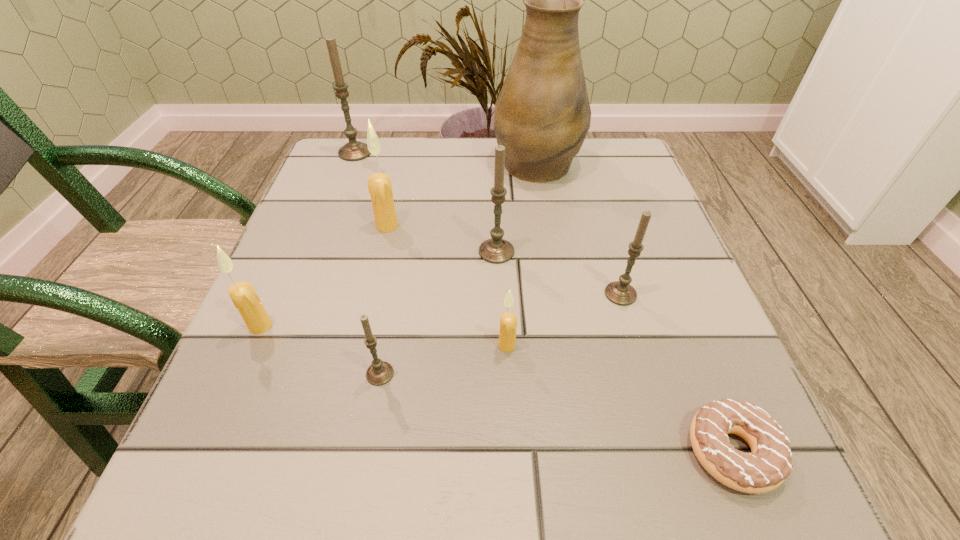
Locate an element on the screen. doughnut present at the right edge is located at coordinates (768, 465).

This screenshot has width=960, height=540. I want to click on object present at the far left corner, so point(354,150).

What are the coordinates of `object positioned at the far right corner` in the screenshot? It's located at (542, 115).

What are the coordinates of `object at the near right corner` in the screenshot? It's located at (768, 465).

Image resolution: width=960 pixels, height=540 pixels. In order to click on vacant space at the far edge of the desktop in this screenshot , I will do `click(415, 139)`.

Find the location of a particular element. The image size is (960, 540). vacant space at the near edge of the desktop is located at coordinates (413, 456).

I want to click on vacant region at the left edge, so click(283, 365).

This screenshot has height=540, width=960. In the image, there is a desktop. Find the location of `free space at the right edge`. free space at the right edge is located at coordinates (652, 305).

Locate an element on the screen. This screenshot has width=960, height=540. vacant space at the far left corner of the desktop is located at coordinates (376, 163).

Locate an element on the screen. vacant area at the near left corner of the desktop is located at coordinates point(264,494).